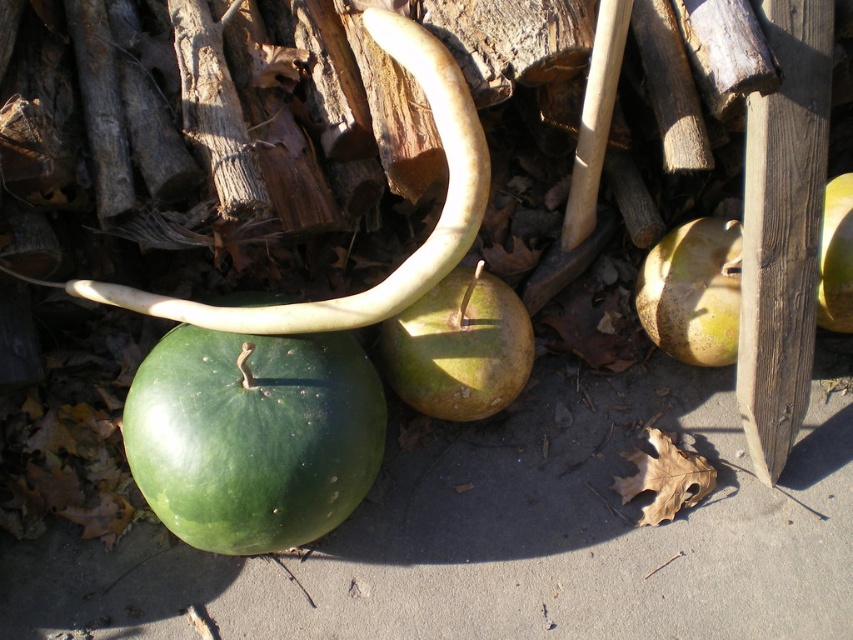
Does green matte gourd at center-left have a smaller size compared to yellow smooth gourd at center?

No, green matte gourd at center-left is not smaller than yellow smooth gourd at center.

Based on the photo, is green matte gourd at center-left wider than yellow smooth gourd at center?

Indeed, green matte gourd at center-left has a greater width compared to yellow smooth gourd at center.

Image resolution: width=853 pixels, height=640 pixels. Identify the location of green matte gourd at center-left. (253, 435).

Is green matte gourd at center-left to the right of green matte gourd at center-right from the viewer's perspective?

In fact, green matte gourd at center-left is to the left of green matte gourd at center-right.

Is point (341, 404) positioned behind point (693, 264)?

No, (341, 404) is closer to viewer.

The width and height of the screenshot is (853, 640). In order to click on green matte gourd at center-left in this screenshot , I will do `click(253, 435)`.

Who is positioned more to the left, green matte gourd at center-right or yellow smooth gourd at center?

green matte gourd at center-right

Describe the element at coordinates (693, 291) in the screenshot. The width and height of the screenshot is (853, 640). I see `green matte gourd at center-right` at that location.

Identify the location of green matte gourd at center-right. This screenshot has height=640, width=853. (693, 291).